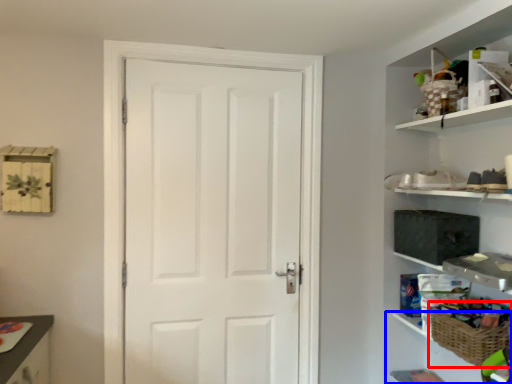
Question: Which object appears closest to the camera in this image, basket (highlighted by a red box) or cabinet (highlighted by a blue box)?

Choices:
 (A) basket
 (B) cabinet

Answer: (A)